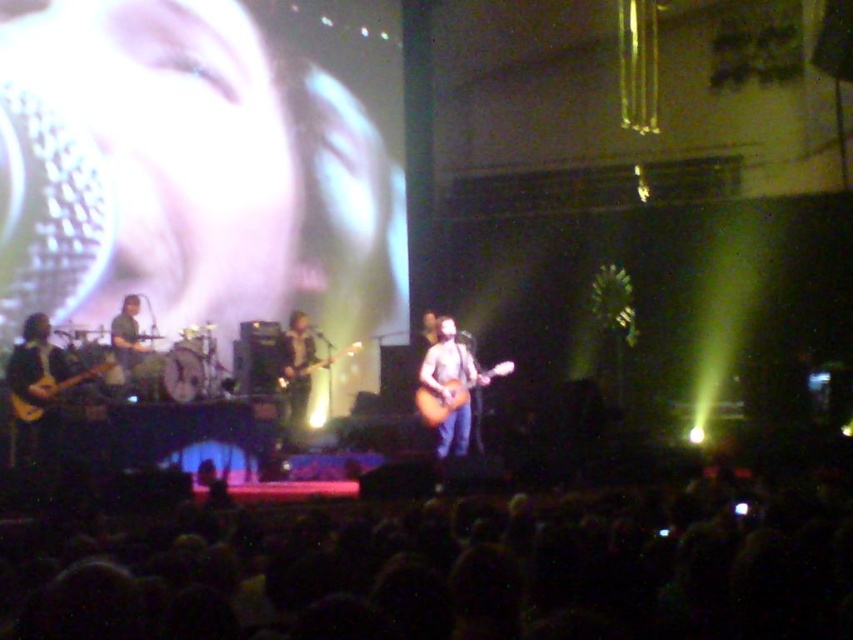
Question: Estimate the real-world distances between objects in this image. Which object is farther from the wooden acoustic guitar at center?

Choices:
 (A) acoustic wood guitar at center
 (B) black hair at lower center
 (C) light brown wood electric guitar at left

Answer: (B)

Question: Is black hair at lower center wider than acoustic wood guitar at center?

Choices:
 (A) no
 (B) yes

Answer: (B)

Question: Does acoustic wood guitar at center come behind light brown wood electric guitar at left?

Choices:
 (A) yes
 (B) no

Answer: (A)

Question: Which point is closer to the camera?

Choices:
 (A) (840, 496)
 (B) (61, 388)

Answer: (A)

Question: Which object is the farthest from the acoustic wood guitar at center?

Choices:
 (A) light brown wood electric guitar at left
 (B) black hair at lower center
 (C) wooden acoustic guitar at center

Answer: (B)

Question: From the image, what is the correct spatial relationship of black hair at lower center in relation to wooden acoustic guitar at center?

Choices:
 (A) below
 (B) above

Answer: (A)